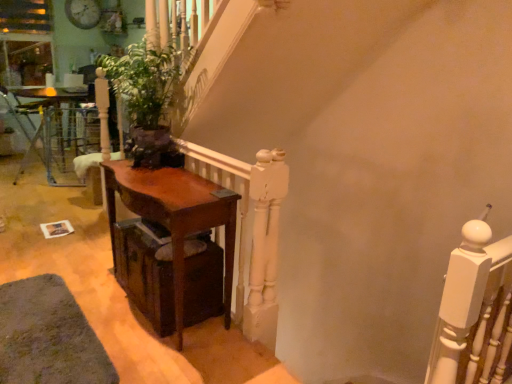
Question: Considering the positions of brown wooden table at left, the second table viewed from the right, and dark wood drawer at lower left in the image, is brown wooden table at left, the second table viewed from the right, bigger or smaller than dark wood drawer at lower left?

Choices:
 (A) big
 (B) small

Answer: (A)

Question: Does point (28, 97) appear closer or farther from the camera than point (161, 332)?

Choices:
 (A) farther
 (B) closer

Answer: (A)

Question: Which object is positioned farthest from the white painted wood at upper right?

Choices:
 (A) green matte plant at center
 (B) mahogany wood table at center, the 1th table from the front
 (C) dark wood drawer at lower left
 (D) brown wooden table at left, the second table positioned from the bottom

Answer: (D)

Question: Which object is positioned farthest from the mahogany wood table at center, marked as the first table in a right-to-left arrangement?

Choices:
 (A) brown wooden table at left, the second table positioned from the bottom
 (B) green matte plant at center
 (C) white painted wood at upper right
 (D) dark wood drawer at lower left

Answer: (A)